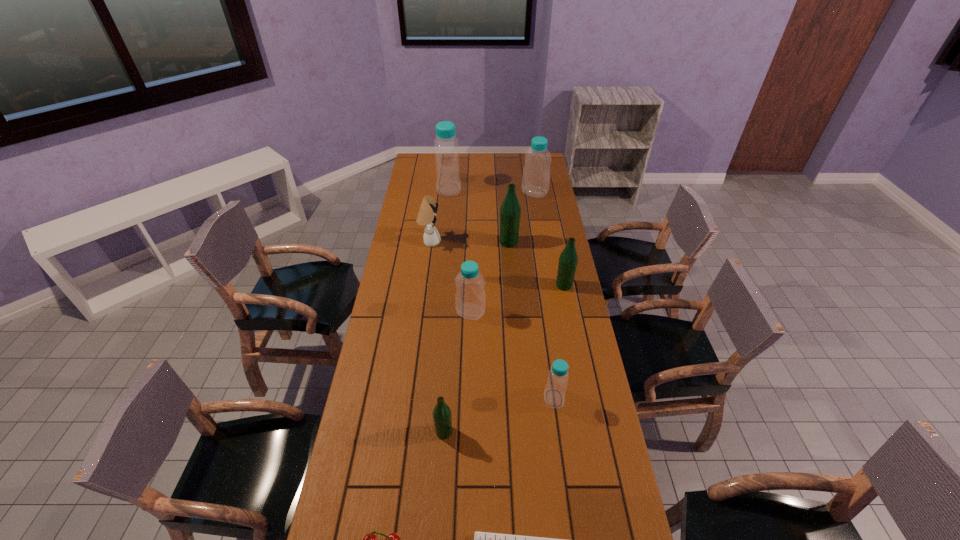
I want to click on the tallest object, so click(x=448, y=183).

Locate an element on the screen. the biggest blue bottle is located at coordinates (448, 183).

Find the location of `the third smallest blue bottle`. the third smallest blue bottle is located at coordinates (536, 173).

Where is `the biggest green bottle`? Image resolution: width=960 pixels, height=540 pixels. the biggest green bottle is located at coordinates (510, 211).

Where is `the fifth nearest bottle`? the fifth nearest bottle is located at coordinates (510, 211).

Image resolution: width=960 pixels, height=540 pixels. Identify the location of doll. (426, 217).

What are the coordinates of `the third nearest bottle` in the screenshot? It's located at (470, 299).

Find the location of a particular element. the sixth farthest object is located at coordinates (470, 299).

Locate an element on the screen. This screenshot has height=540, width=960. the rightmost green bottle is located at coordinates (x=568, y=259).

This screenshot has width=960, height=540. Find the location of `the second smallest green bottle`. the second smallest green bottle is located at coordinates (568, 259).